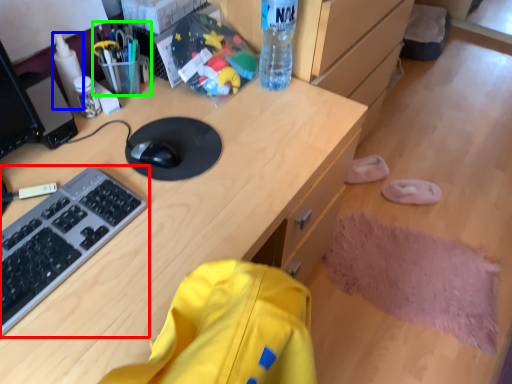
Question: Estimate the real-world distances between objects in this image. Which object is farther from computer keyboard (highlighted by a red box), bottle (highlighted by a blue box) or stationery (highlighted by a green box)?

Choices:
 (A) bottle
 (B) stationery

Answer: (B)